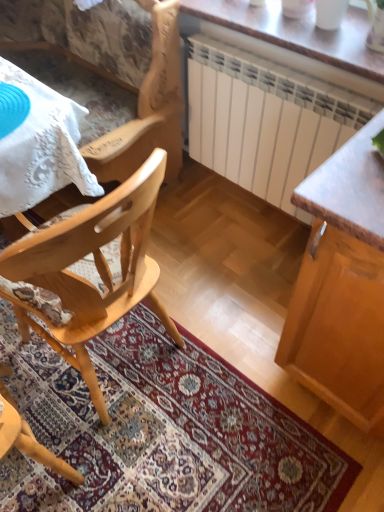
Question: Is wooden cabinet at right looking in the opposite direction of wooden table at upper center?

Choices:
 (A) yes
 (B) no

Answer: (B)

Question: Is wooden cabinet at right closer to camera compared to wooden table at upper center?

Choices:
 (A) yes
 (B) no

Answer: (A)

Question: From a real-world perspective, is wooden cabinet at right positioned over wooden table at upper center based on gravity?

Choices:
 (A) yes
 (B) no

Answer: (B)

Question: Are wooden cabinet at right and wooden table at upper center far apart?

Choices:
 (A) yes
 (B) no

Answer: (B)

Question: From a real-world perspective, is wooden cabinet at right under wooden table at upper center?

Choices:
 (A) yes
 (B) no

Answer: (A)

Question: Is wooden cabinet at right wider than wooden table at upper center?

Choices:
 (A) yes
 (B) no

Answer: (A)

Question: Is white lace tablecloth at upper left to the left of wooden cabinet at right from the viewer's perspective?

Choices:
 (A) no
 (B) yes

Answer: (B)

Question: Is white lace tablecloth at upper left taller than wooden cabinet at right?

Choices:
 (A) no
 (B) yes

Answer: (A)

Question: Can you confirm if white lace tablecloth at upper left is wider than wooden cabinet at right?

Choices:
 (A) yes
 (B) no

Answer: (A)

Question: Is the position of white lace tablecloth at upper left less distant than that of wooden cabinet at right?

Choices:
 (A) no
 (B) yes

Answer: (A)

Question: Considering the relative sizes of white lace tablecloth at upper left and wooden cabinet at right in the image provided, is white lace tablecloth at upper left smaller than wooden cabinet at right?

Choices:
 (A) yes
 (B) no

Answer: (A)

Question: Does white lace tablecloth at upper left touch wooden cabinet at right?

Choices:
 (A) yes
 (B) no

Answer: (B)

Question: From the image's perspective, is wooden table at upper center located beneath wooden cabinet at right?

Choices:
 (A) no
 (B) yes

Answer: (A)